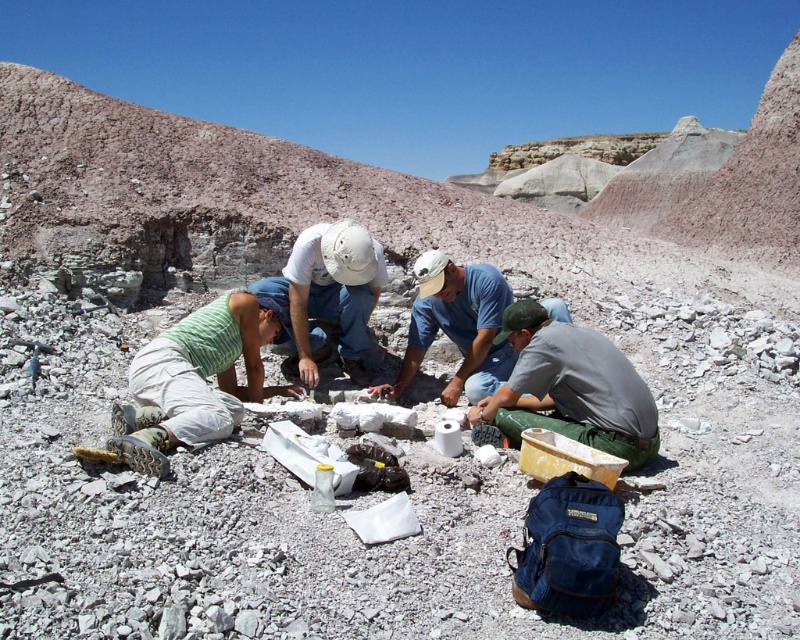
Question: Observing the image, what is the correct spatial positioning of gray matte shirt at center in reference to gray cotton shirt at center?

Choices:
 (A) right
 (B) left

Answer: (A)

Question: Which object appears closest to the camera in this image?

Choices:
 (A) gray matte shirt at center
 (B) green striped tank top at lower left
 (C) white matte helmet at center

Answer: (A)

Question: Which of the following is the closest to the observer?

Choices:
 (A) (342, 348)
 (B) (472, 353)
 (C) (150, 353)

Answer: (C)

Question: Which point is closer to the camera?

Choices:
 (A) (420, 330)
 (B) (512, 419)
 (C) (222, 429)

Answer: (C)

Question: Can you confirm if gray matte shirt at center is bigger than gray cotton shirt at center?

Choices:
 (A) yes
 (B) no

Answer: (B)

Question: Is white matte helmet at center behind gray cotton shirt at center?

Choices:
 (A) no
 (B) yes

Answer: (B)